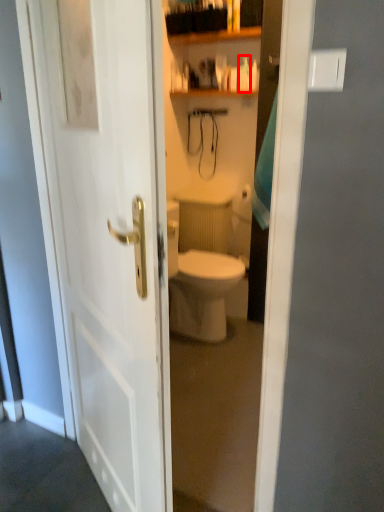
Question: In this image, where is toiletry (annotated by the red box) located relative to glass door?

Choices:
 (A) left
 (B) right

Answer: (B)